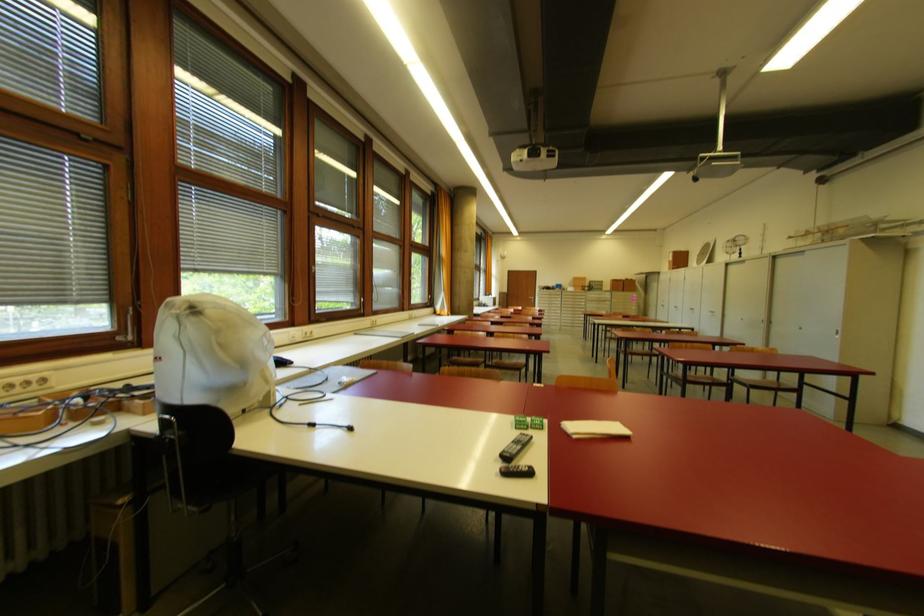
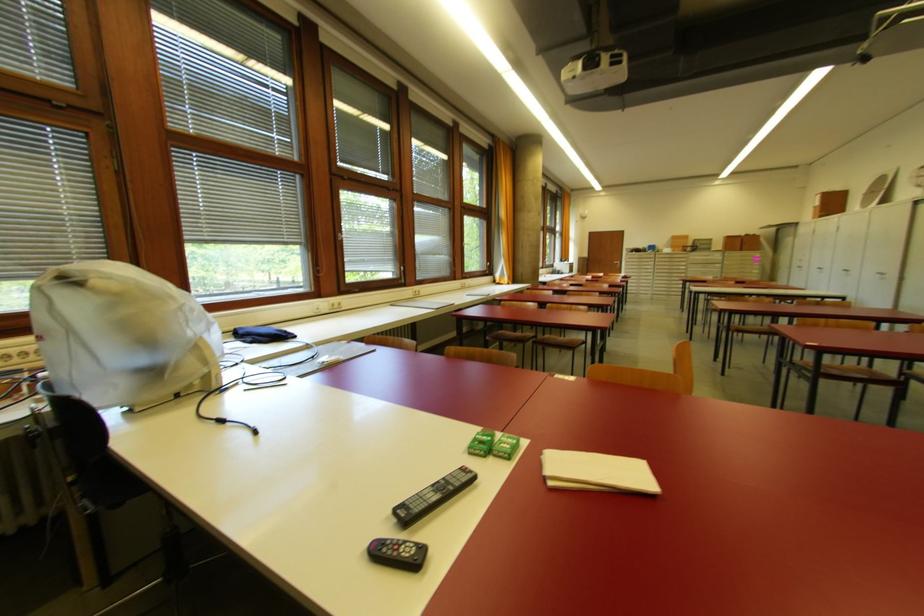
Question: How did the camera likely rotate?

Choices:
 (A) Left
 (B) Right
 (C) Up
 (D) Down

Answer: (A)